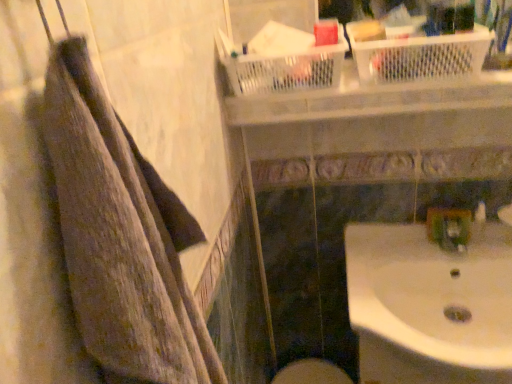
Question: Does white glossy sink at lower right come behind brown textured towel at left?

Choices:
 (A) no
 (B) yes

Answer: (B)

Question: Is white glossy sink at lower right not near brown textured towel at left?

Choices:
 (A) no
 (B) yes

Answer: (A)

Question: Is white glossy sink at lower right thinner than brown textured towel at left?

Choices:
 (A) yes
 (B) no

Answer: (B)

Question: Is white glossy sink at lower right at the right side of brown textured towel at left?

Choices:
 (A) yes
 (B) no

Answer: (A)

Question: From a real-world perspective, is white glossy sink at lower right on brown textured towel at left?

Choices:
 (A) yes
 (B) no

Answer: (B)

Question: Is brown textured towel at left wider or thinner than white glossy sink at lower right?

Choices:
 (A) thin
 (B) wide

Answer: (A)

Question: Does point (160, 367) appear closer or farther from the camera than point (433, 344)?

Choices:
 (A) farther
 (B) closer

Answer: (B)

Question: Considering the positions of brown textured towel at left and white glossy sink at lower right in the image, is brown textured towel at left taller or shorter than white glossy sink at lower right?

Choices:
 (A) short
 (B) tall

Answer: (B)

Question: Would you say brown textured towel at left is inside or outside white glossy sink at lower right?

Choices:
 (A) inside
 (B) outside

Answer: (B)

Question: Is point (425, 218) closer or farther from the camera than point (459, 311)?

Choices:
 (A) farther
 (B) closer

Answer: (A)

Question: From the image's perspective, is green plastic faucet at lower right above or below white glossy sink at lower right?

Choices:
 (A) above
 (B) below

Answer: (A)

Question: Considering the positions of green plastic faucet at lower right and white glossy sink at lower right in the image, is green plastic faucet at lower right taller or shorter than white glossy sink at lower right?

Choices:
 (A) short
 (B) tall

Answer: (A)

Question: Based on their positions, is green plastic faucet at lower right located to the left or right of white glossy sink at lower right?

Choices:
 (A) left
 (B) right

Answer: (B)

Question: In terms of width, does white glossy sink at lower right look wider or thinner when compared to brown textured towel at left?

Choices:
 (A) thin
 (B) wide

Answer: (B)

Question: In terms of size, does white glossy sink at lower right appear bigger or smaller than brown textured towel at left?

Choices:
 (A) small
 (B) big

Answer: (B)